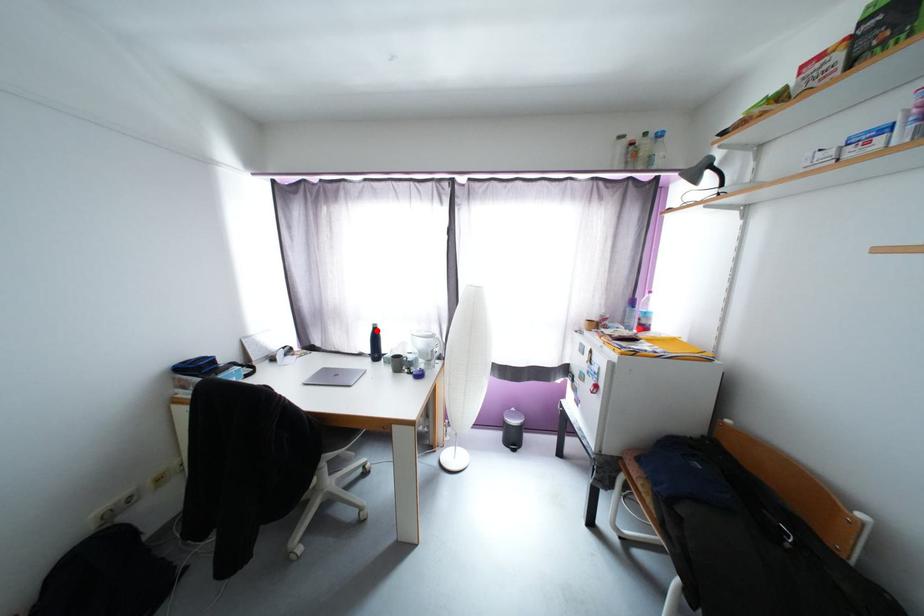
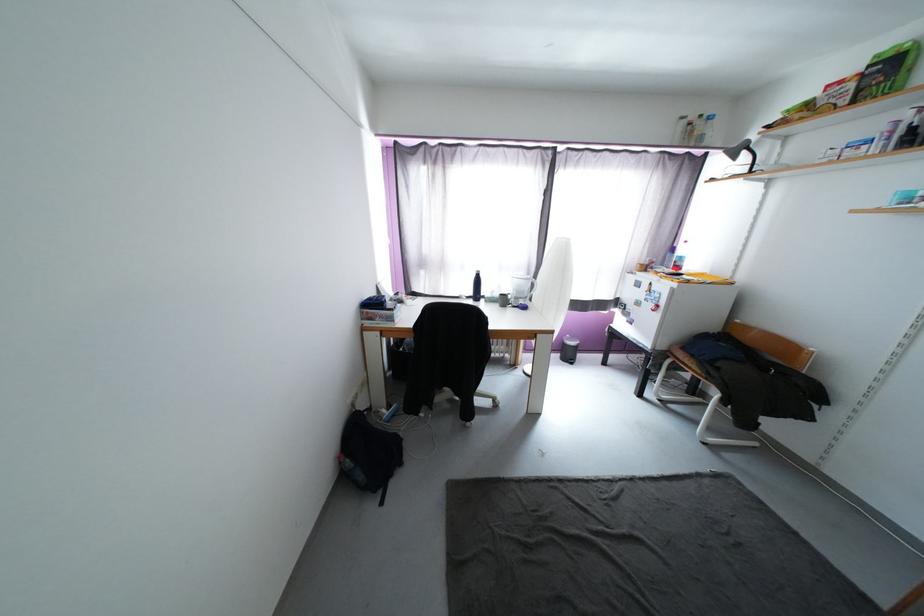
Locate, in the second image, the point that corresponds to the highlighted location in the first image.

(480, 277)